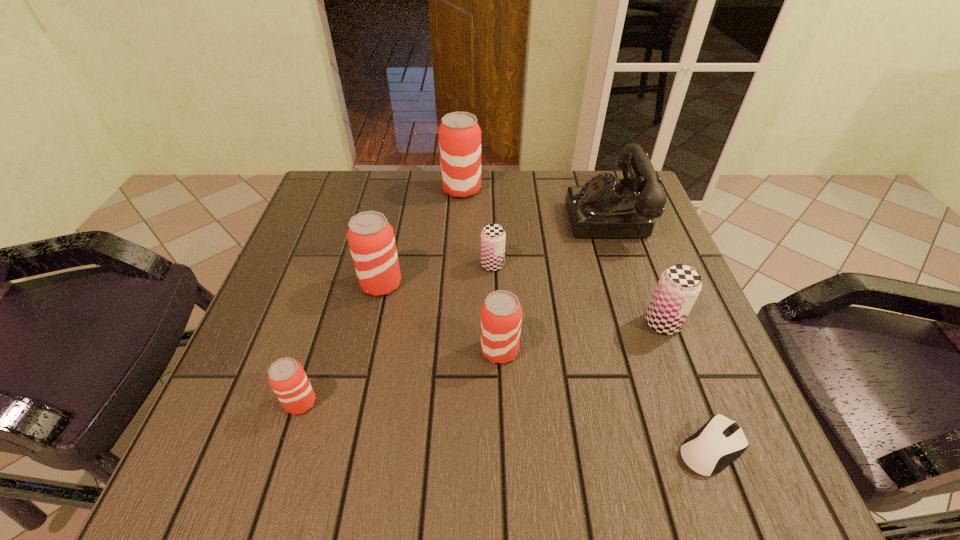
This screenshot has height=540, width=960. I want to click on object identified as the third closest to the fifth beer can from right to left, so click(x=287, y=378).

Identify the location of the fourth closest object to the nearest orange beer can. This screenshot has height=540, width=960. (459, 133).

Point out which beer can is positioned as the second nearest to the left purple beer can. Please provide its 2D coordinates. Your answer should be formatted as a tuple, i.e. [(x, y)], where the tuple contains the x and y coordinates of a point satisfying the conditions above.

[(501, 314)]

Select which beer can is the closest to the shortest object. Please provide its 2D coordinates. Your answer should be formatted as a tuple, i.e. [(x, y)], where the tuple contains the x and y coordinates of a point satisfying the conditions above.

[(679, 286)]

Identify which orange beer can is the second nearest to the smaller purple beer can. Please provide its 2D coordinates. Your answer should be formatted as a tuple, i.e. [(x, y)], where the tuple contains the x and y coordinates of a point satisfying the conditions above.

[(501, 314)]

Select which orange beer can is the third closest to the smaller purple beer can. Please provide its 2D coordinates. Your answer should be formatted as a tuple, i.e. [(x, y)], where the tuple contains the x and y coordinates of a point satisfying the conditions above.

[(459, 133)]

Locate an element on the screen. The width and height of the screenshot is (960, 540). free space that satisfies the following two spatial constraints: 1. on the dial of the rightmost beer can; 2. on the left side of the telephone is located at coordinates (647, 323).